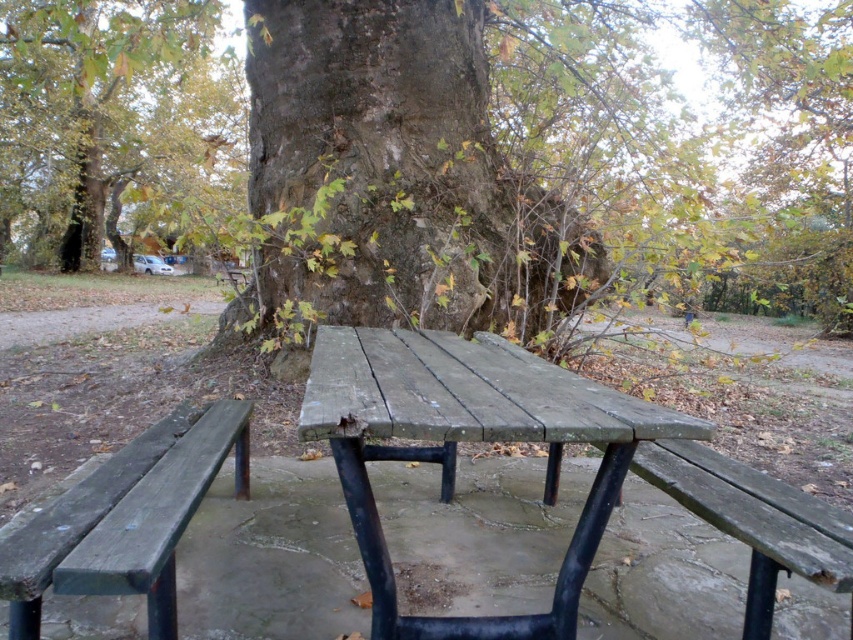
Which is in front, point (582, 26) or point (79, 86)?

Point (79, 86)

Who is more distant from viewer, (x=490, y=275) or (x=132, y=240)?

Positioned behind is point (x=132, y=240).

You are a GUI agent. You are given a task and a screenshot of the screen. Output one action in this format:
    pyautogui.click(x=<x>, y=<y>)
    Task: Click on the rough bark tree at center
    
    Given the screenshot: What is the action you would take?
    pyautogui.click(x=433, y=154)

Between point (224, 451) and point (804, 541), which one is positioned behind?

The point (224, 451) is behind.

Who is more forward, (x=241, y=452) or (x=843, y=541)?

Point (x=843, y=541) is in front.

This screenshot has width=853, height=640. Describe the element at coordinates (125, 518) in the screenshot. I see `weathered wood bench at lower left` at that location.

You are a GUI agent. You are given a task and a screenshot of the screen. Output one action in this format:
    pyautogui.click(x=<x>, y=<y>)
    Task: Click on the weathered wood bench at lower left
    
    Given the screenshot: What is the action you would take?
    [125, 518]

Between rough bark tree at center and weathered wood bench at lower left, which one appears on the right side from the viewer's perspective?

From the viewer's perspective, weathered wood bench at lower left appears more on the right side.

Does rough bark tree at center lie in front of weathered wood bench at lower left?

That is False.

Is point (468, 317) less distant than point (80, 536)?

No, it is behind (80, 536).

Find the location of a particular element. This screenshot has height=640, width=853. rough bark tree at center is located at coordinates (433, 154).